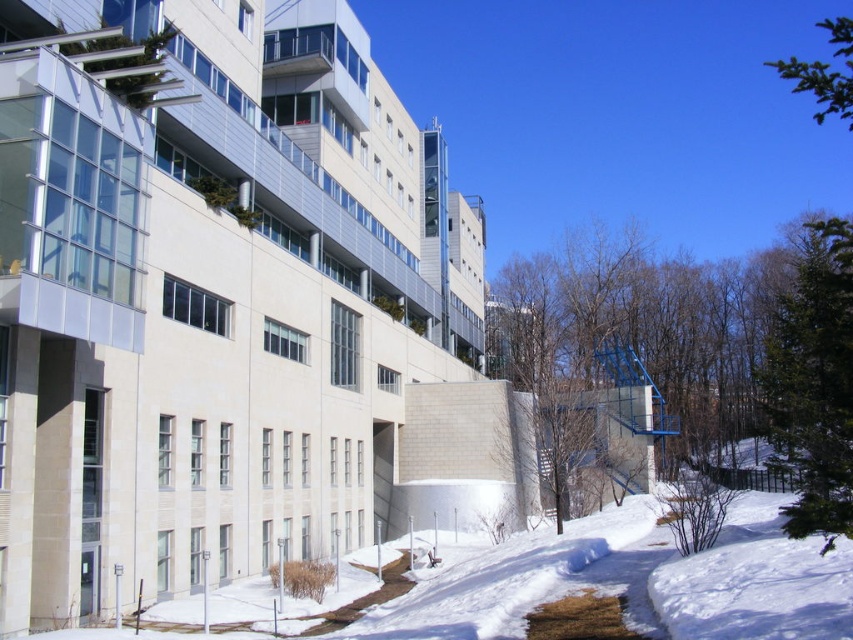
Question: Can you confirm if green leafy tree at right is positioned to the right of green textured pine tree at upper right?

Choices:
 (A) yes
 (B) no

Answer: (B)

Question: Based on their relative distances, which object is farther from the green textured pine tree at upper right?

Choices:
 (A) green textured evergreen tree at right
 (B) green leafy tree at right

Answer: (B)

Question: Which point is farther to the camera?

Choices:
 (A) (799, 512)
 (B) (563, 384)
 (C) (793, 80)

Answer: (C)

Question: Does green leafy tree at right appear under green textured pine tree at upper right?

Choices:
 (A) yes
 (B) no

Answer: (A)

Question: Which of the following is the farthest from the observer?

Choices:
 (A) green textured pine tree at upper right
 (B) green leafy tree at right

Answer: (A)

Question: Can you confirm if green leafy tree at right is smaller than green textured evergreen tree at right?

Choices:
 (A) no
 (B) yes

Answer: (A)